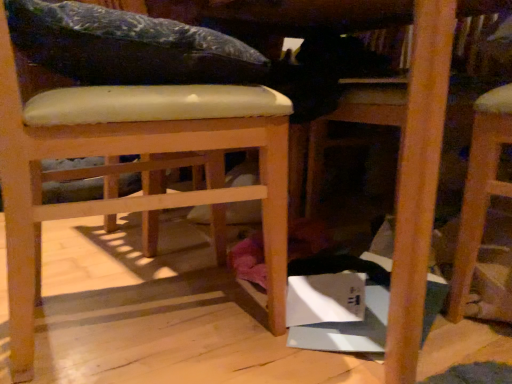
Find the location of a particular element. Image resolution: width=512 pixels, height=384 pixels. free space behind matte wood chair at center is located at coordinates (140, 251).